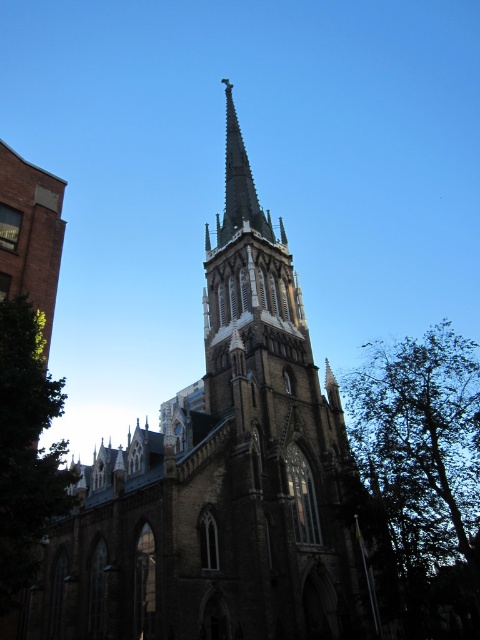
Question: Is stone church steeple at center above green leafy tree at lower left?

Choices:
 (A) yes
 (B) no

Answer: (A)

Question: Considering the relative positions of green leafy tree at right and green leafy tree at lower left in the image provided, where is green leafy tree at right located with respect to green leafy tree at lower left?

Choices:
 (A) left
 (B) right

Answer: (B)

Question: Can you confirm if stone church steeple at center is positioned above green leafy tree at lower left?

Choices:
 (A) yes
 (B) no

Answer: (A)

Question: Which point appears farthest from the camera in this image?

Choices:
 (A) (269, 563)
 (B) (384, 433)
 (C) (0, 563)

Answer: (B)

Question: Which is nearer to the green leafy tree at lower left?

Choices:
 (A) stone church steeple at center
 (B) green leafy tree at right

Answer: (A)

Question: Which object is closer to the camera taking this photo?

Choices:
 (A) stone church steeple at center
 (B) green leafy tree at lower left
 (C) green leafy tree at right

Answer: (B)